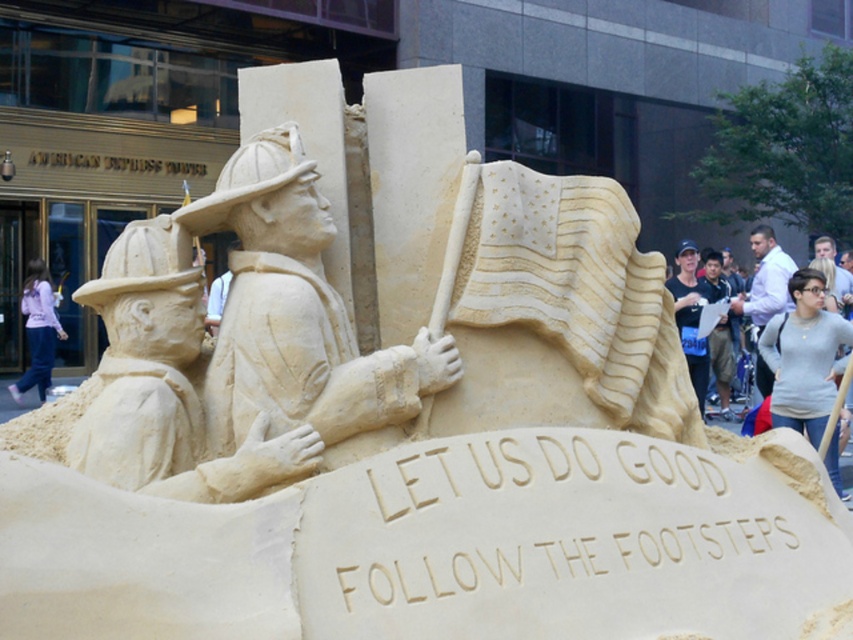
You are a photographer trying to capture both the white shirt at right and the matte beige sand sculpture at center in a single frame. Based on their heights, which object will appear larger in the photo?

The white shirt at right is much taller than the matte beige sand sculpture at center, so it will appear larger in the photo.

You are standing in front of the sand sculpture and want to take a photo of the white shirt at right and the matte beige sand sculpture at center. If your camera has a maximum focus range of 6 feet, will both objects be in focus?

The white shirt at right is 6.76 feet away from matte beige sand sculpture at center. Since the camera can only focus up to 6 feet, the distance between them exceeds the focus range, so both objects may not be in focus simultaneously.